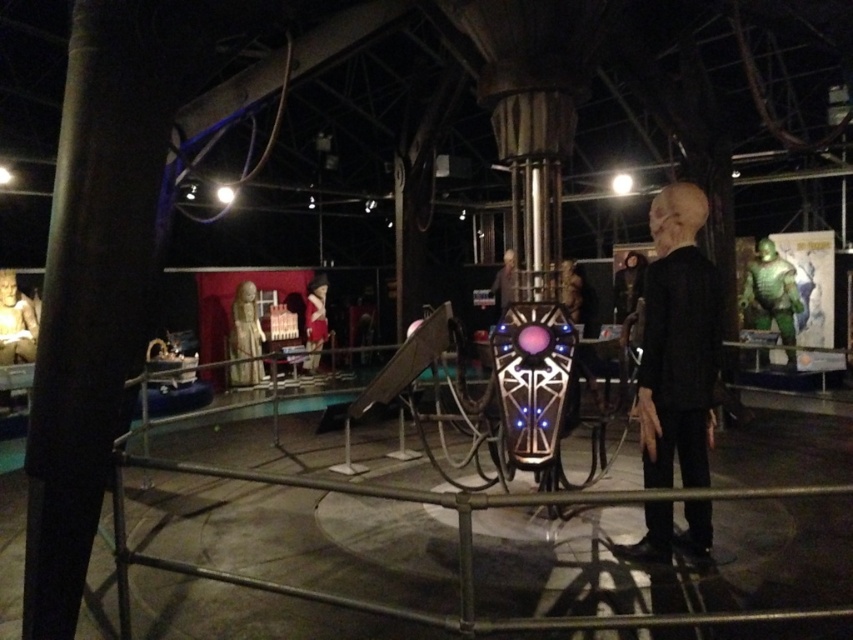
Is green metallic alien at right further to the viewer compared to matte gold statue at center?

No, it is in front of matte gold statue at center.

Looking at this image, is green metallic alien at right to the right of matte gold statue at center from the viewer's perspective?

Yes, green metallic alien at right is to the right of matte gold statue at center.

Is point (753, 260) less distant than point (308, 320)?

Yes, point (753, 260) is closer to viewer.

This screenshot has height=640, width=853. I want to click on green metallic alien at right, so click(x=772, y=294).

From the picture: Is green metallic alien at right to the right of matte black alien at center from the viewer's perspective?

Yes, green metallic alien at right is to the right of matte black alien at center.

Does green metallic alien at right have a lesser height compared to matte black alien at center?

No, green metallic alien at right is not shorter than matte black alien at center.

Describe the element at coordinates (772, 294) in the screenshot. I see `green metallic alien at right` at that location.

Where is `green metallic alien at right`? This screenshot has height=640, width=853. green metallic alien at right is located at coordinates (772, 294).

Is green metallic alien at right wider than matte white statue at left?

Correct, the width of green metallic alien at right exceeds that of matte white statue at left.

This screenshot has width=853, height=640. I want to click on green metallic alien at right, so click(772, 294).